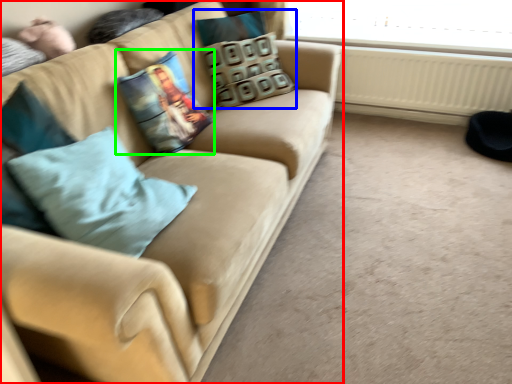
Question: Which is nearer to the studio couch (highlighted by a red box)? pillow (highlighted by a blue box) or pillow (highlighted by a green box).

Choices:
 (A) pillow
 (B) pillow

Answer: (B)